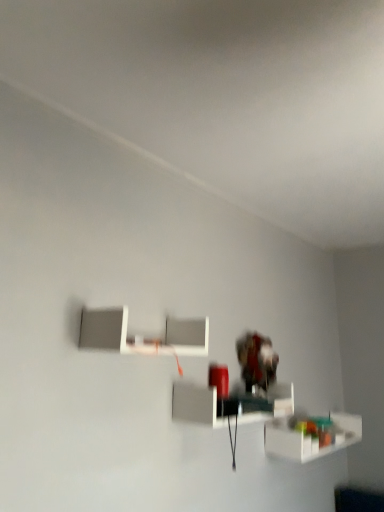
Question: From a real-world perspective, is white matte shelf at upper center, which is the 3th shelf in right-to-left order, beneath translucent plastic shelf at lower right, placed as the first shelf when sorted from bottom to top?

Choices:
 (A) yes
 (B) no

Answer: (B)

Question: Does white matte shelf at upper center, which is the 3th shelf in right-to-left order, have a smaller size compared to translucent plastic shelf at lower right, which is the 1th shelf in right-to-left order?

Choices:
 (A) no
 (B) yes

Answer: (B)

Question: Can you confirm if white matte shelf at upper center, which is the 3th shelf in right-to-left order, is shorter than translucent plastic shelf at lower right, which is the 1th shelf in right-to-left order?

Choices:
 (A) no
 (B) yes

Answer: (A)

Question: From the image's perspective, is white matte shelf at upper center, the 1th shelf viewed from the top, under translucent plastic shelf at lower right, arranged as the 3th shelf when viewed from the left?

Choices:
 (A) no
 (B) yes

Answer: (A)

Question: Is white matte shelf at upper center, which is the 3th shelf in right-to-left order, beside translucent plastic shelf at lower right, placed as the first shelf when sorted from bottom to top?

Choices:
 (A) no
 (B) yes

Answer: (A)

Question: From a real-world perspective, does white matte shelf at upper center, the 1th shelf positioned from the left, stand above translucent plastic shelf at lower right, arranged as the 3th shelf when viewed from the left?

Choices:
 (A) yes
 (B) no

Answer: (A)

Question: Is white glossy shelf at center, the 2th shelf positioned from the left, touching white matte shelf at upper center, which is the 3th shelf in right-to-left order?

Choices:
 (A) no
 (B) yes

Answer: (A)

Question: Can you confirm if white glossy shelf at center, arranged as the 2th shelf when viewed from the right, is bigger than white matte shelf at upper center, which is the 3th shelf in right-to-left order?

Choices:
 (A) yes
 (B) no

Answer: (A)

Question: Considering the relative sizes of white glossy shelf at center, the 2th shelf positioned from the left, and white matte shelf at upper center, the 1th shelf viewed from the top, in the image provided, is white glossy shelf at center, the 2th shelf positioned from the left, wider than white matte shelf at upper center, the 1th shelf viewed from the top,?

Choices:
 (A) yes
 (B) no

Answer: (A)

Question: Is white glossy shelf at center, arranged as the 2th shelf when viewed from the right, not near white matte shelf at upper center, which is the 3th shelf in right-to-left order?

Choices:
 (A) yes
 (B) no

Answer: (B)

Question: Is white glossy shelf at center, which appears as the second shelf when viewed from the top, to the left of white matte shelf at upper center, the 1th shelf viewed from the top, from the viewer's perspective?

Choices:
 (A) no
 (B) yes

Answer: (A)

Question: Considering the relative sizes of white glossy shelf at center, which appears as the second shelf when viewed from the top, and white matte shelf at upper center, the 1th shelf viewed from the top, in the image provided, is white glossy shelf at center, which appears as the second shelf when viewed from the top, taller than white matte shelf at upper center, the 1th shelf viewed from the top,?

Choices:
 (A) no
 (B) yes

Answer: (A)

Question: Does translucent plastic shelf at lower right, which is the 1th shelf in right-to-left order, come behind white matte shelf at upper center, which is the 3th shelf in right-to-left order?

Choices:
 (A) no
 (B) yes

Answer: (B)